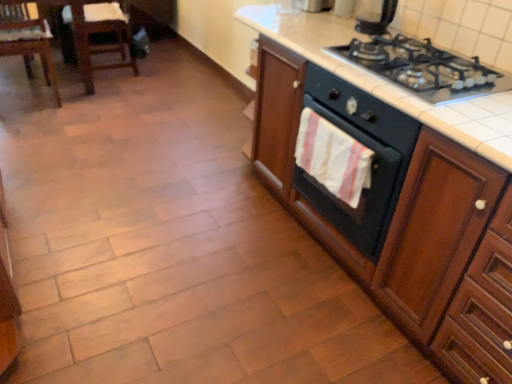
Question: From the image's perspective, is wooden cabinet at right located above or below black glass gas stove at upper right?

Choices:
 (A) above
 (B) below

Answer: (B)

Question: Is wooden cabinet at right situated inside black glass gas stove at upper right or outside?

Choices:
 (A) outside
 (B) inside

Answer: (A)

Question: Based on their relative distances, which object is farther from the wooden chair at left?

Choices:
 (A) black matte oven at center-right
 (B) wooden cabinet at right
 (C) black glass gas stove at upper right
 (D) white cotton hand towel at center-right
 (E) black glossy kettle at upper right

Answer: (C)

Question: Which is farther from the wooden chair at left?

Choices:
 (A) black matte oven at center-right
 (B) white cotton hand towel at center-right
 (C) wooden cabinet at right
 (D) black glass gas stove at upper right
 (E) black glossy kettle at upper right

Answer: (D)